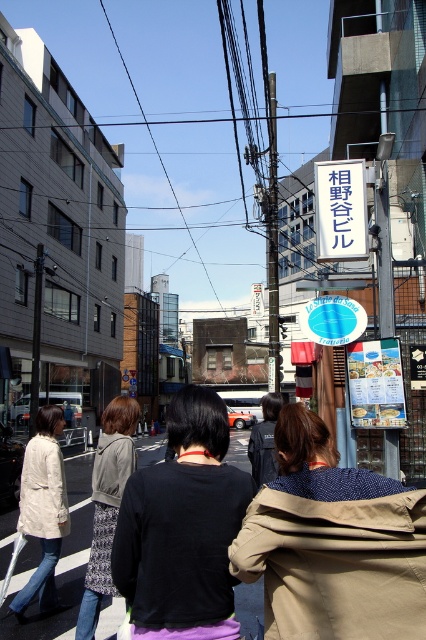
Question: Is the position of black fabric shirt at center more distant than that of white plastic sign at upper center?

Choices:
 (A) yes
 (B) no

Answer: (B)

Question: Does light beige jacket at lower left have a lesser width compared to dark blue jacket at center?

Choices:
 (A) no
 (B) yes

Answer: (A)

Question: Which point appears closest to the camera in this image?

Choices:
 (A) (48, 593)
 (B) (259, 422)

Answer: (A)

Question: Estimate the real-world distances between objects in this image. Which object is closer to the white plastic sign at upper center?

Choices:
 (A) black fabric shirt at center
 (B) light beige jacket at lower left

Answer: (B)

Question: Does black fabric shirt at center have a greater width compared to dark blue jacket at center?

Choices:
 (A) no
 (B) yes

Answer: (B)

Question: Which of these objects is positioned farthest from the patterned fabric coat at center?

Choices:
 (A) black fabric shirt at center
 (B) white plastic sign at upper center

Answer: (B)